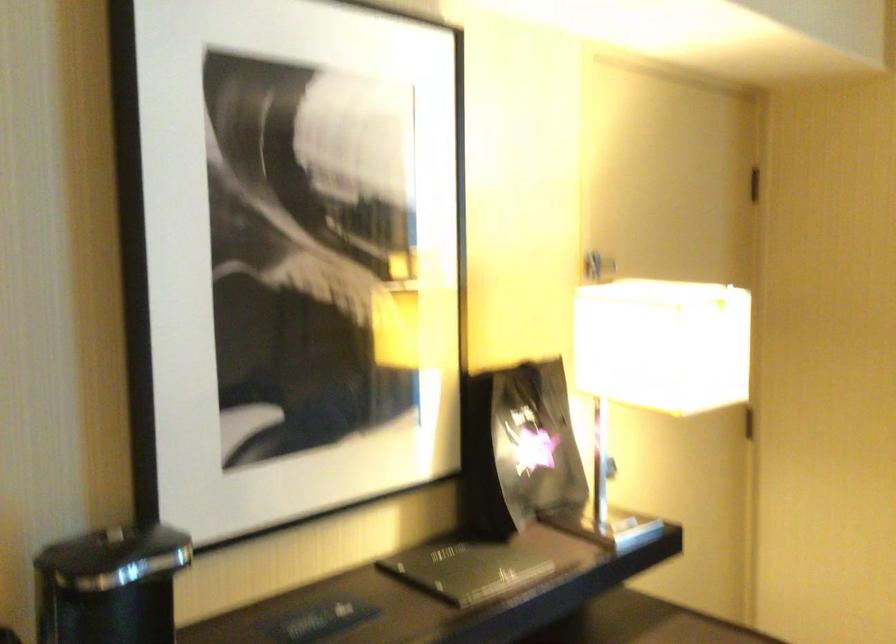
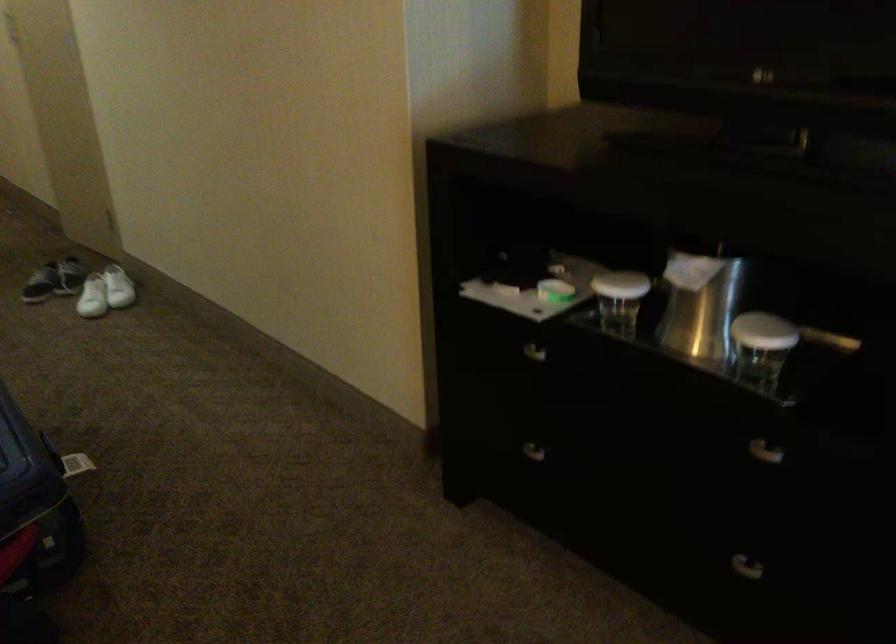
The first image is from the beginning of the video and the second image is from the end. How did the camera likely rotate when shooting the video?

The camera's rotation is toward left-down.